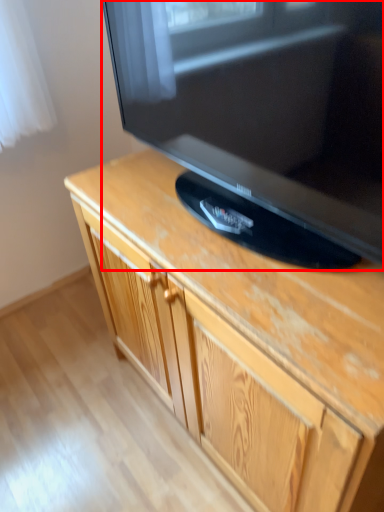
Question: From the image's perspective, where is television (annotated by the red box) located relative to cabinetry?

Choices:
 (A) above
 (B) below

Answer: (A)